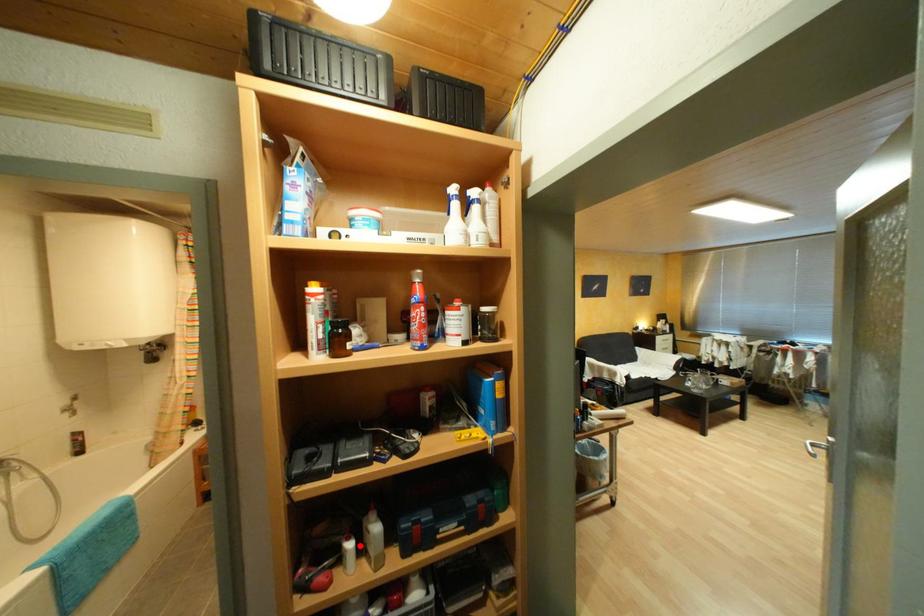
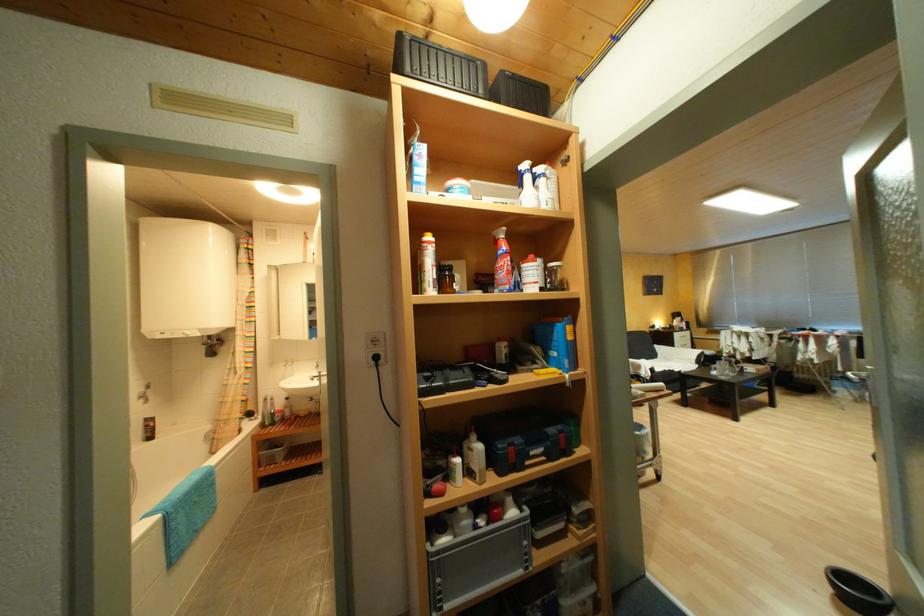
Find the pixel in the second image that matches the highlighted location in the first image.

(467, 461)